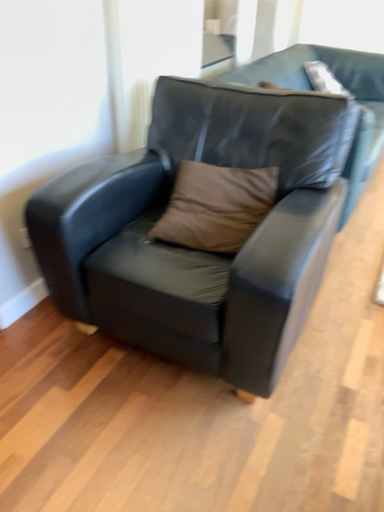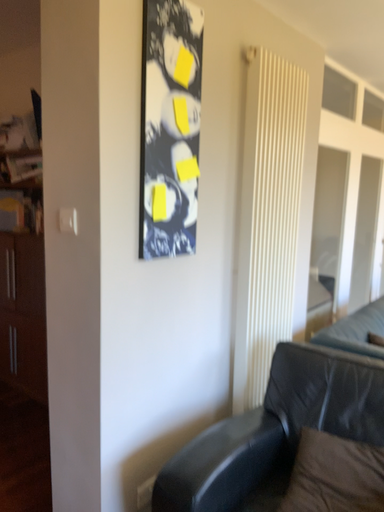
Question: How did the camera likely rotate when shooting the video?

Choices:
 (A) rotated downward
 (B) rotated upward

Answer: (B)